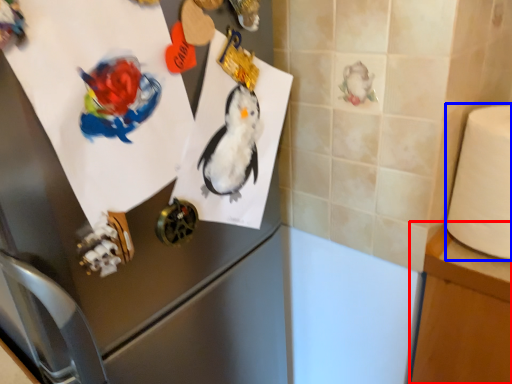
Question: Which object appears farthest to the camera in this image, table (highlighted by a red box) or toilet paper (highlighted by a blue box)?

Choices:
 (A) table
 (B) toilet paper

Answer: (A)